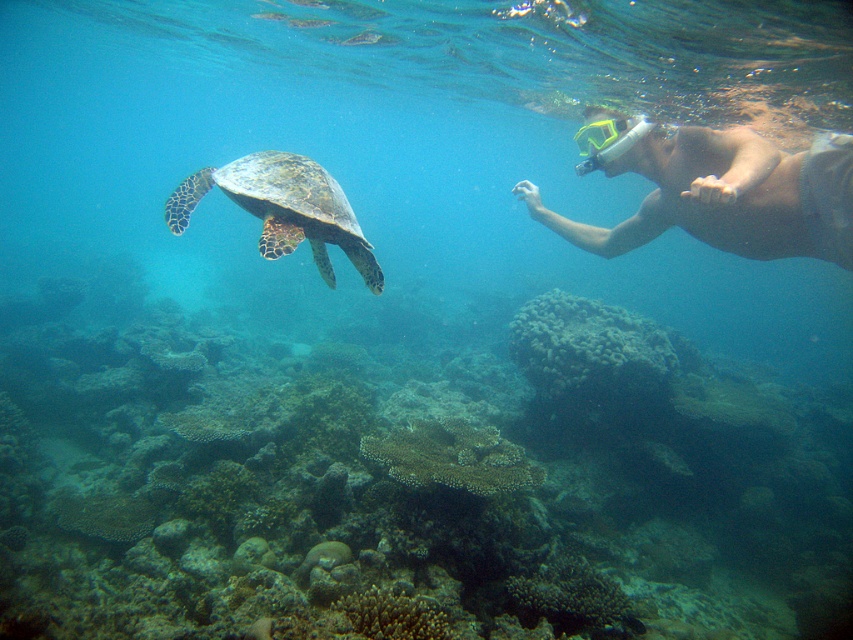
You are a marine biologist studying the snorkeler and the turtle in the underwater scene. You notice a specific point marked at coordinates (726,195). Based on the scene description, which object does this point correspond to?

The point at coordinates (726,195) corresponds to the smooth skin diver at right.